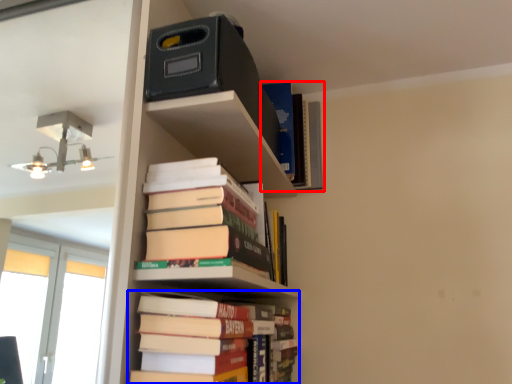
Question: Which of the following is the closest to the observer, book (highlighted by a red box) or book (highlighted by a blue box)?

Choices:
 (A) book
 (B) book

Answer: (B)